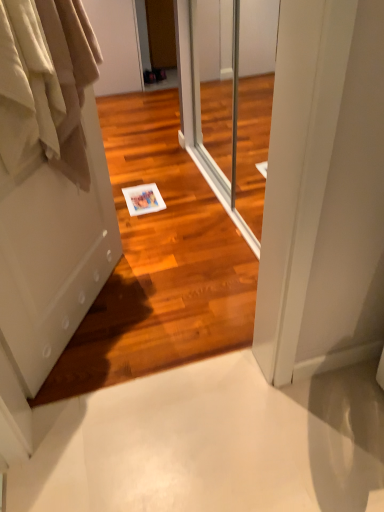
What do you see at coordinates (50, 182) in the screenshot?
I see `white matte door at left` at bounding box center [50, 182].

What do you see at coordinates (45, 84) in the screenshot? The height and width of the screenshot is (512, 384). I see `beige cotton curtains at left` at bounding box center [45, 84].

The image size is (384, 512). What do you see at coordinates (230, 100) in the screenshot?
I see `transparent glass screen door at center` at bounding box center [230, 100].

Where is `white matte door at left`? white matte door at left is located at coordinates 50,182.

At what (x,y) coordinates should I click in order to perform the action: click on clothing above the white matte door at left (from a real-world perspective). Please return your answer as a coordinate pair (x, y). Image resolution: width=384 pixels, height=512 pixels. Looking at the image, I should click on pyautogui.click(x=45, y=84).

From the image's perspective, is beige cotton curtains at left beneath white matte door at left?

No.

Is beige cotton curtains at left taller than white matte door at left?

No, beige cotton curtains at left is not taller than white matte door at left.

In terms of width, does beige cotton curtains at left look wider or thinner when compared to white matte door at left?

beige cotton curtains at left is wider than white matte door at left.

Based on the photo, is beige cotton curtains at left positioned beyond the bounds of transparent glass screen door at center?

Indeed, beige cotton curtains at left is completely outside transparent glass screen door at center.

Based on the photo, is beige cotton curtains at left directly adjacent to transparent glass screen door at center?

They are not placed beside each other.

From a real-world perspective, which object rests below the other?

In real-world perspective, transparent glass screen door at center is lower.

From the image's perspective, who appears lower, beige cotton curtains at left or transparent glass screen door at center?

beige cotton curtains at left appears lower in the image.

What's the angular difference between transparent glass screen door at center and white matte door at left's facing directions?

There is a 147-degree angle between the facing directions of transparent glass screen door at center and white matte door at left.

Can you confirm if transparent glass screen door at center is taller than white matte door at left?

In fact, transparent glass screen door at center may be shorter than white matte door at left.

Does transparent glass screen door at center have a larger size compared to white matte door at left?

Indeed, transparent glass screen door at center has a larger size compared to white matte door at left.

Is the surface of transparent glass screen door at center in direct contact with white matte door at left?

No, transparent glass screen door at center is not beside white matte door at left.

Considering the sizes of transparent glass screen door at center and beige cotton curtains at left in the image, is transparent glass screen door at center wider or thinner than beige cotton curtains at left?

Considering their sizes, transparent glass screen door at center looks slimmer than beige cotton curtains at left.

In the scene shown: From the image's perspective, which is below, transparent glass screen door at center or beige cotton curtains at left?

beige cotton curtains at left.

In the image, there is a beige cotton curtains at left. Where is `screen door above it (from the image's perspective)`? screen door above it (from the image's perspective) is located at coordinates (230, 100).

How far apart are white matte door at left and transparent glass screen door at center?

4.52 feet.

From the picture: Can you confirm if white matte door at left is taller than transparent glass screen door at center?

Indeed, white matte door at left has a greater height compared to transparent glass screen door at center.

From a real-world perspective, who is located lower, white matte door at left or transparent glass screen door at center?

From a 3D spatial view, transparent glass screen door at center is below.

Does white matte door at left have a lesser width compared to transparent glass screen door at center?

Indeed, white matte door at left has a lesser width compared to transparent glass screen door at center.

Is white matte door at left positioned with its back to beige cotton curtains at left?

Yes, beige cotton curtains at left is at the back of white matte door at left.

Is white matte door at left at the right side of beige cotton curtains at left?

No, white matte door at left is not to the right of beige cotton curtains at left.

From the image's perspective, would you say white matte door at left is shown under beige cotton curtains at left?

Yes.

Considering the positions of point (90, 158) and point (58, 76), is point (90, 158) closer or farther from the camera than point (58, 76)?

Point (90, 158) appears to be farther away from the viewer than point (58, 76).

Find the location of `clothing that appears above the white matte door at left (from the image's perspective)`. clothing that appears above the white matte door at left (from the image's perspective) is located at coordinates (45, 84).

Locate an element on the screen. screen door behind the beige cotton curtains at left is located at coordinates (230, 100).

Looking at the image, which one is located further to transparent glass screen door at center, beige cotton curtains at left or white matte door at left?

beige cotton curtains at left is further to transparent glass screen door at center.

Which object lies further to the anchor point white matte door at left, beige cotton curtains at left or transparent glass screen door at center?

The object further to white matte door at left is transparent glass screen door at center.

When comparing their distances from transparent glass screen door at center, does white matte door at left or beige cotton curtains at left seem closer?

white matte door at left lies closer to transparent glass screen door at center than the other object.

Which object lies further to the anchor point beige cotton curtains at left, transparent glass screen door at center or white matte door at left?

Based on the image, transparent glass screen door at center appears to be further to beige cotton curtains at left.

Based on their spatial positions, is white matte door at left or transparent glass screen door at center closer to beige cotton curtains at left?

white matte door at left is closer to beige cotton curtains at left.

Looking at the image, which one is located further to white matte door at left, transparent glass screen door at center or beige cotton curtains at left?

Among the two, transparent glass screen door at center is located further to white matte door at left.

At what (x,y) coordinates should I click in order to perform the action: click on clothing between white matte door at left and transparent glass screen door at center from left to right. Please return your answer as a coordinate pair (x, y). Looking at the image, I should click on (45, 84).